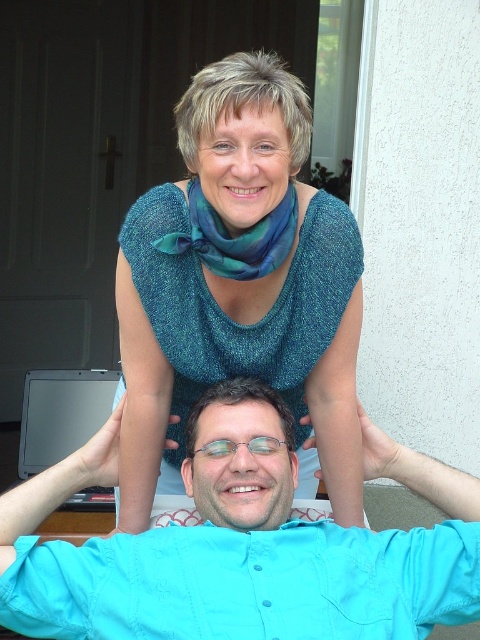
You are a delivery robot that is 12 inches wide. You need to move from the teal silk scarf at upper center to the clear plastic glasses at center. Can you pass through the space between them?

The distance between the teal silk scarf at upper center and clear plastic glasses at center is 24.91 inches. Since the robot is 12 inches wide, it can pass through the space between them as the distance is greater than the robot width.

You are trying to decide whether to hang a small picture frame on the wall between the teal silk scarf at upper center and the clear plastic glasses at center. The frame is 10 cm tall. Based on their heights, can you determine if there is enough vertical space between them to hang the frame?

The teal silk scarf at upper center is much taller than the clear plastic glasses at center, so there is sufficient vertical space between them to hang the frame.